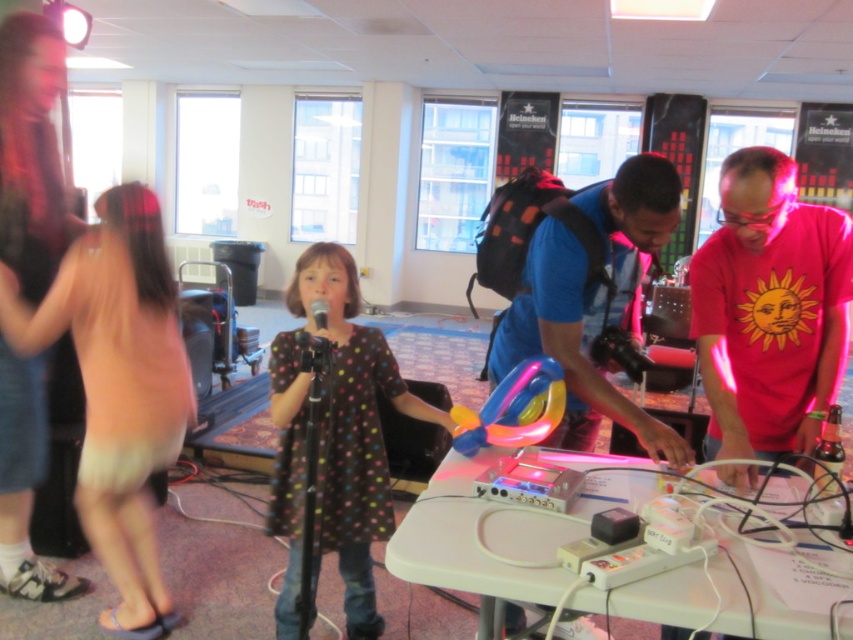
Question: Which object appears closest to the camera in this image?

Choices:
 (A) sun-printed t-shirt at right
 (B) black matte microphone at center

Answer: (A)

Question: From the image, what is the correct spatial relationship of polka dot fabric dress at center in relation to black matte microphone at center?

Choices:
 (A) below
 (B) above

Answer: (A)

Question: Estimate the real-world distances between objects in this image. Which object is farther from the translucent neon balloon at center?

Choices:
 (A) black matte microphone at center
 (B) sun-printed t-shirt at right

Answer: (B)

Question: Is pink satin dress at left closer to camera compared to polka dot fabric dress at center?

Choices:
 (A) no
 (B) yes

Answer: (A)

Question: Which is farther from the black matte microphone at center?

Choices:
 (A) polka dot fabric dress at center
 (B) sun-printed t-shirt at right

Answer: (B)

Question: Does polka dot fabric dress at center have a greater width compared to translucent neon balloon at center?

Choices:
 (A) yes
 (B) no

Answer: (A)